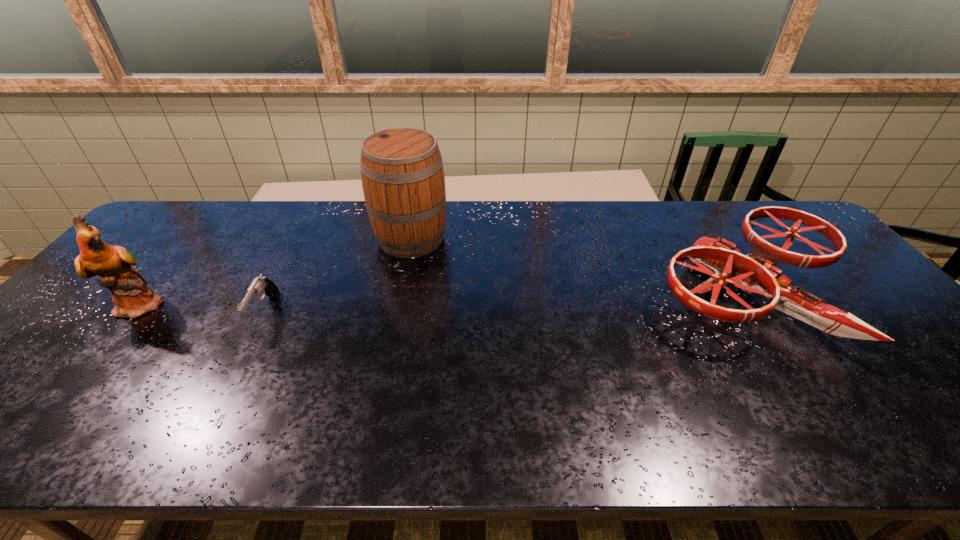
Locate an element on the screen. cider is located at coordinates (403, 181).

Identify the location of the leftmost object. (133, 298).

Find the location of a particular element. drone is located at coordinates (754, 273).

The image size is (960, 540). I want to click on the rightmost object, so click(754, 273).

At what (x,y) coordinates should I click in order to perform the action: click on the second object from left to right. Please return your answer as a coordinate pair (x, y). Looking at the image, I should click on (260, 285).

Identify the location of gun. The width and height of the screenshot is (960, 540). (260, 285).

At what (x,y) coordinates should I click in order to perform the action: click on free space located on the front of the third object from left to right. Please return your answer as a coordinate pair (x, y). Image resolution: width=960 pixels, height=540 pixels. Looking at the image, I should click on (402, 282).

Where is `vacant space situated on the front-facing side of the leftmost object`? The image size is (960, 540). vacant space situated on the front-facing side of the leftmost object is located at coordinates (279, 305).

Identify the location of vacant space located 0.060m on the front of the third tallest object. (806, 388).

Where is `free spot located at the muzzle of the second object from left to right`? Image resolution: width=960 pixels, height=540 pixels. free spot located at the muzzle of the second object from left to right is located at coordinates (228, 383).